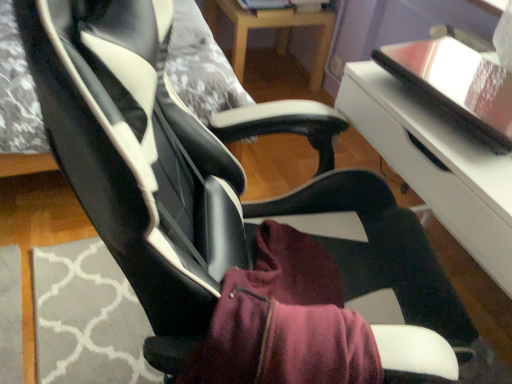
Question: Considering the positions of point (443, 125) and point (244, 23), is point (443, 125) closer or farther from the camera than point (244, 23)?

Choices:
 (A) farther
 (B) closer

Answer: (B)

Question: Is white glossy table at center, marked as the first table in a bottom-to-top arrangement, wider or thinner than wooden table at center, placed as the 2th table when sorted from front to back?

Choices:
 (A) wide
 (B) thin

Answer: (A)

Question: Would you say white glossy table at center, which is counted as the 2th table, starting from the back, is inside or outside wooden table at center, placed as the 2th table when sorted from front to back?

Choices:
 (A) outside
 (B) inside

Answer: (A)

Question: From the image's perspective, is wooden table at center, which is counted as the 2th table, starting from the bottom, located above or below white glossy table at center, which is counted as the 2th table, starting from the back?

Choices:
 (A) below
 (B) above

Answer: (B)

Question: From a real-world perspective, is wooden table at center, placed as the 2th table when sorted from front to back, physically located above or below white glossy table at center, marked as the first table in a bottom-to-top arrangement?

Choices:
 (A) below
 (B) above

Answer: (A)

Question: From their relative heights in the image, would you say wooden table at center, the 1th table in the top-to-bottom sequence, is taller or shorter than white glossy table at center, which is counted as the 2th table, starting from the back?

Choices:
 (A) short
 (B) tall

Answer: (A)

Question: Considering the positions of point (316, 77) and point (509, 200), is point (316, 77) closer or farther from the camera than point (509, 200)?

Choices:
 (A) farther
 (B) closer

Answer: (A)